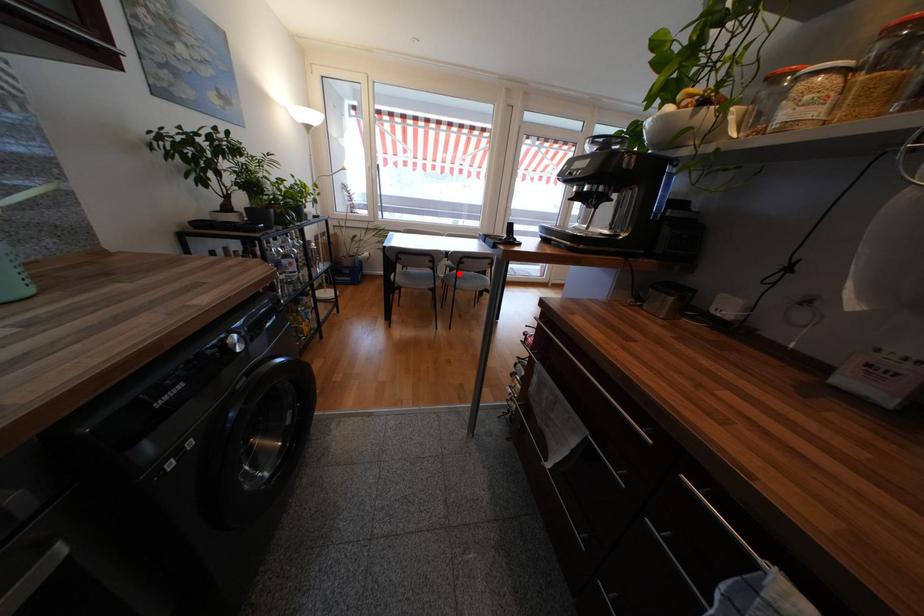
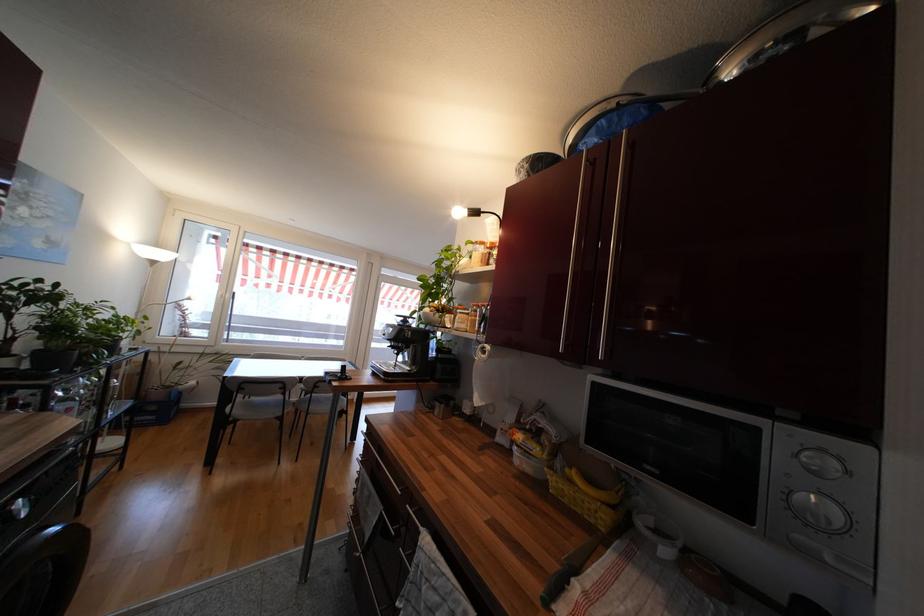
Question: I am providing you with two images of the same scene from different viewpoints. Image1 has a red point marked. In image2, the corresponding 3D location appears at what relative position? Reply with the corresponding letter.

Choices:
 (A) Closer
 (B) Farther

Answer: (B)